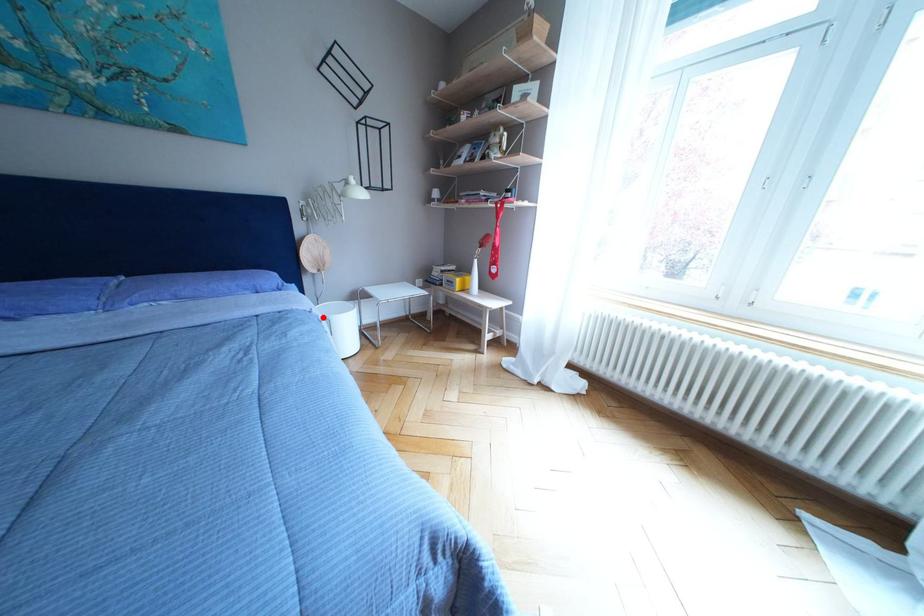
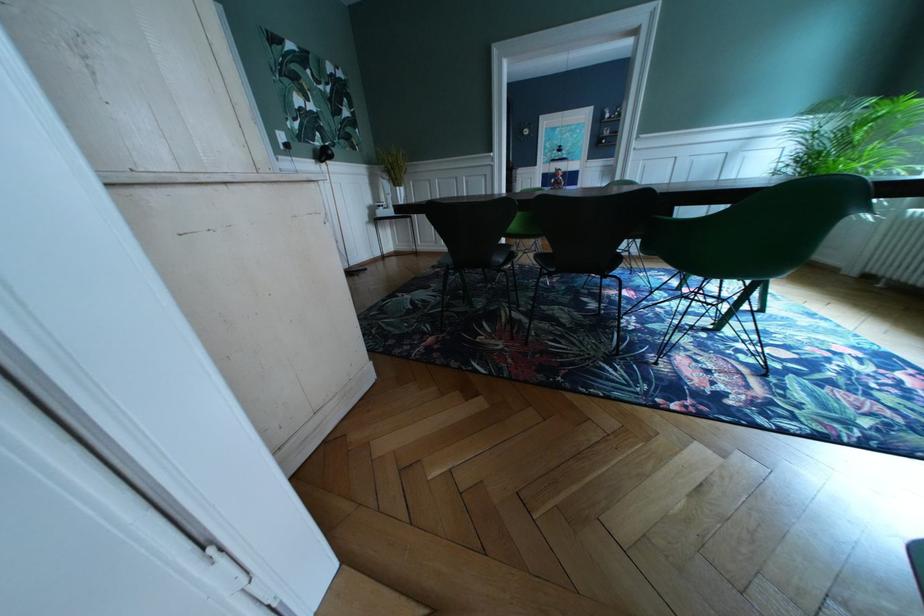
Question: I am providing you with two images of the same scene from different viewpoints. A red point is marked on the first image. Is the red point's position out of view in image 2?

Choices:
 (A) Yes
 (B) No

Answer: (A)